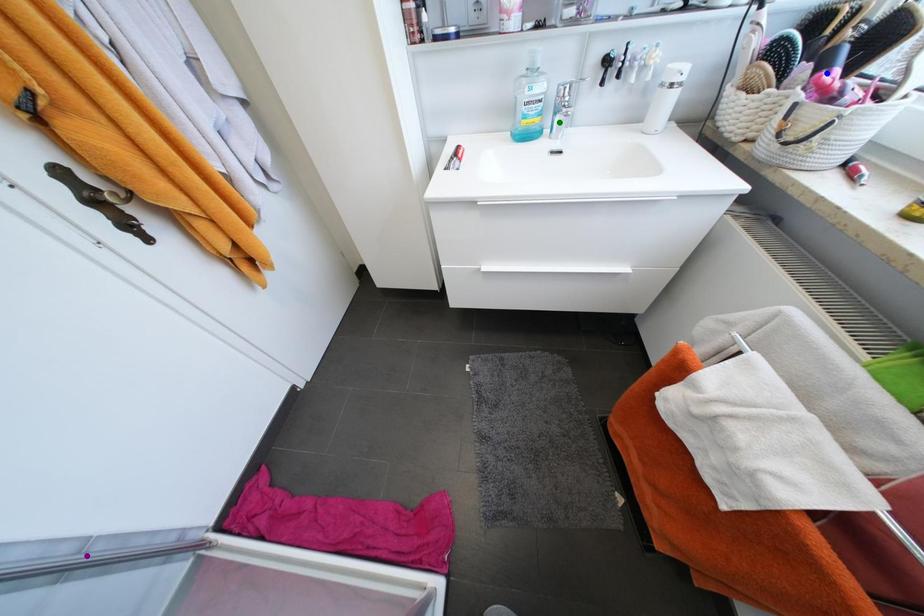
Order these from nearest to farthest:
purple point
blue point
green point

blue point < purple point < green point